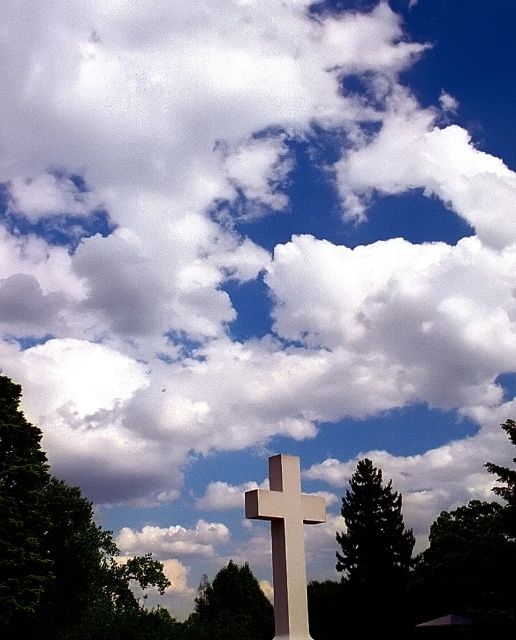
Question: Which of the following is the closest to the observer?

Choices:
 (A) pyautogui.click(x=1, y=470)
 (B) pyautogui.click(x=401, y=554)
 (C) pyautogui.click(x=205, y=614)

Answer: (A)

Question: Among these objects, which one is farthest from the camera?

Choices:
 (A) green leafy tree at center
 (B) green matte tree at center
 (C) green leafy tree at upper left
 (D) white smooth cross at center

Answer: (B)

Question: Which of the following is the closest to the observer?

Choices:
 (A) green leafy tree at center
 (B) green leafy tree at upper left

Answer: (A)

Question: Does green leafy tree at upper left have a greater width compared to white smooth cross at center?

Choices:
 (A) yes
 (B) no

Answer: (A)

Question: Observing the image, what is the correct spatial positioning of green matte tree at center in reference to green leafy tree at center?

Choices:
 (A) right
 (B) left

Answer: (A)

Question: Does green leafy tree at upper left have a smaller size compared to green leafy tree at center?

Choices:
 (A) no
 (B) yes

Answer: (B)